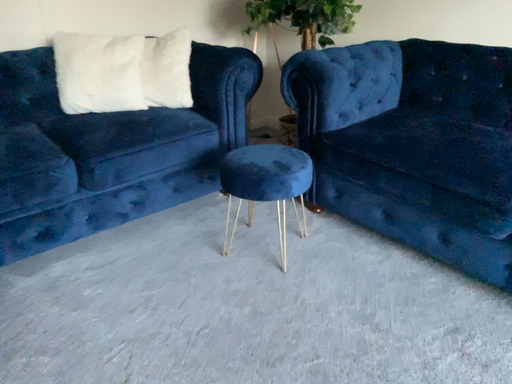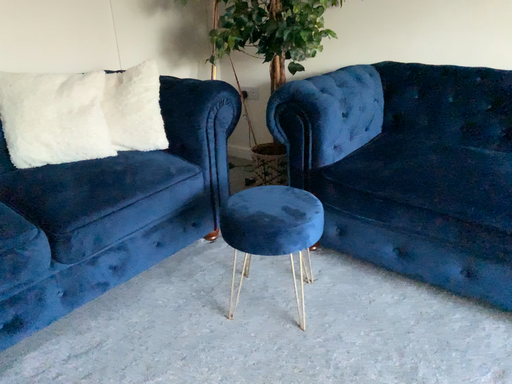
Question: How did the camera likely rotate when shooting the video?

Choices:
 (A) rotated left
 (B) rotated right

Answer: (B)